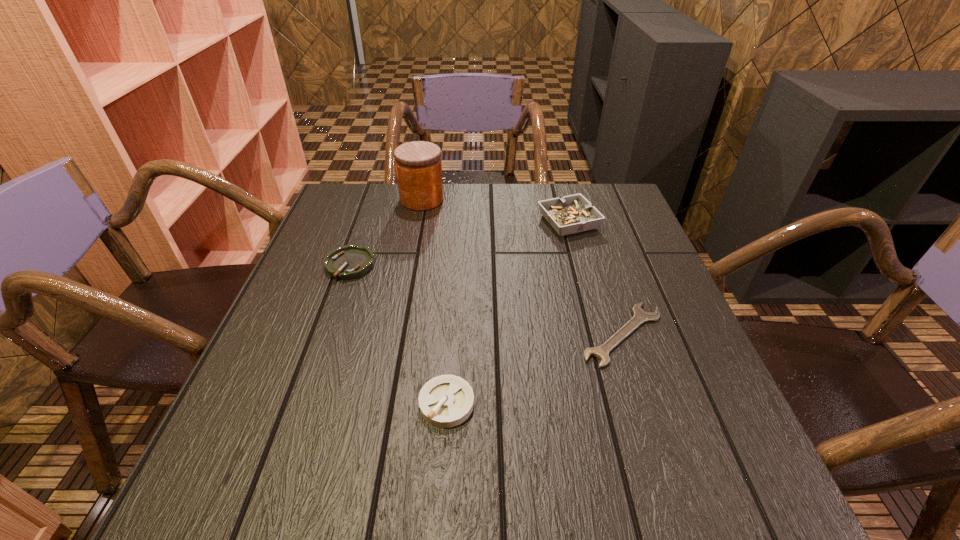
At what (x,y) coordinates should I click in order to perform the action: click on the tallest object. Please return your answer as a coordinate pair (x, y). Looking at the image, I should click on (418, 164).

Locate an element on the screen. The image size is (960, 540). the rightmost ashtray is located at coordinates tap(571, 214).

The image size is (960, 540). I want to click on the tallest ashtray, so click(x=571, y=214).

Identify the location of the nearest ashtray. The width and height of the screenshot is (960, 540). (445, 401).

Where is `the nearest object`? This screenshot has width=960, height=540. the nearest object is located at coordinates (445, 401).

Locate an element on the screen. the second farthest ashtray is located at coordinates (347, 262).

Locate an element on the screen. This screenshot has height=540, width=960. the leftmost object is located at coordinates (347, 262).

You are a GUI agent. You are given a task and a screenshot of the screen. Output one action in this format:
    pyautogui.click(x=<x>, y=<y>)
    Task: Click on the wrench
    
    Given the screenshot: What is the action you would take?
    pyautogui.click(x=640, y=316)

Image resolution: width=960 pixels, height=540 pixels. Identify the location of the fourth farthest object. (640, 316).

In order to click on vacant region located 0.300m on the front of the jar in this screenshot , I will do (406, 281).